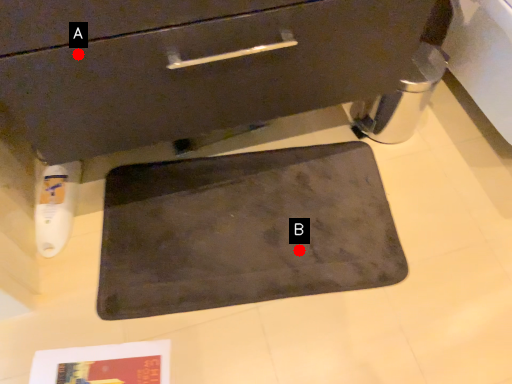
Question: Two points are circled on the image, labeled by A and B beside each circle. Among these points, which one is nearest to the camera?

Choices:
 (A) A is closer
 (B) B is closer

Answer: (A)